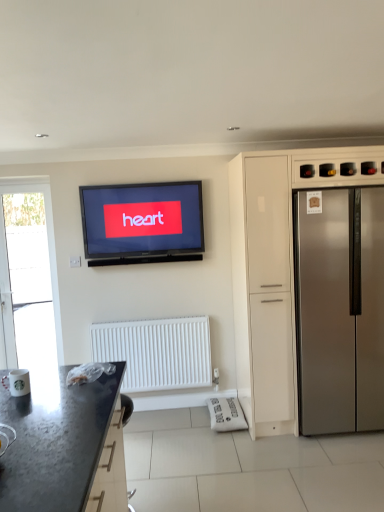
Find the location of a particular element. Image resolution: width=384 pixels, height=512 pixels. black granite countertop at lower left is located at coordinates (64, 446).

This screenshot has width=384, height=512. Describe the element at coordinates (157, 352) in the screenshot. I see `white matte radiator at lower center` at that location.

Measure the distance between point (173, 368) and camera.

The distance of point (173, 368) from camera is 3.60 meters.

Identify the location of stainless steel refrigerator at right. The height and width of the screenshot is (512, 384). (340, 310).

The image size is (384, 512). What are the coordinates of `black granite countertop at lower left` in the screenshot? It's located at (64, 446).

You are a GUI agent. You are given a task and a screenshot of the screen. Output one action in this format:
    pyautogui.click(x=<x>, y=<y>)
    Task: Click on the cabinetry on the right of white matte radiator at lower center
    
    Given the screenshot: What is the action you would take?
    pyautogui.click(x=276, y=245)

Is white matte radiator at lower center positioned far away from satin silver refrigerator at right?

Actually, white matte radiator at lower center and satin silver refrigerator at right are a little close together.

Consider the image. How different are the orientations of white matte radiator at lower center and satin silver refrigerator at right in degrees?

0.27 degrees separate the facing orientations of white matte radiator at lower center and satin silver refrigerator at right.

Is white matte radiator at lower center behind satin silver refrigerator at right?

Yes, white matte radiator at lower center is further from the camera.

Looking at this image, considering the relative sizes of stainless steel refrigerator at right and satin silver refrigerator at right in the image provided, is stainless steel refrigerator at right bigger than satin silver refrigerator at right?

Incorrect, stainless steel refrigerator at right is not larger than satin silver refrigerator at right.

This screenshot has height=512, width=384. Find the location of `cabinetry positioned vertically above the stainless steel refrigerator at right (from a real-world perspective)`. cabinetry positioned vertically above the stainless steel refrigerator at right (from a real-world perspective) is located at coordinates (276, 245).

From the image's perspective, would you say stainless steel refrigerator at right is positioned over satin silver refrigerator at right?

No, from the image's perspective, stainless steel refrigerator at right is not on top of satin silver refrigerator at right.

Considering the sizes of stainless steel refrigerator at right and satin silver refrigerator at right in the image, is stainless steel refrigerator at right taller or shorter than satin silver refrigerator at right?

Clearly, stainless steel refrigerator at right is shorter compared to satin silver refrigerator at right.

Considering the sizes of objects satin silver refrigerator at right and matte black television at upper center in the image provided, who is bigger, satin silver refrigerator at right or matte black television at upper center?

With larger size is satin silver refrigerator at right.

Considering the positions of objects satin silver refrigerator at right and matte black television at upper center in the image provided, who is more to the left, satin silver refrigerator at right or matte black television at upper center?

Positioned to the left is matte black television at upper center.

Is satin silver refrigerator at right in contact with matte black television at upper center?

No, satin silver refrigerator at right is not next to matte black television at upper center.

Considering the relative sizes of satin silver refrigerator at right and matte black television at upper center in the image provided, is satin silver refrigerator at right wider than matte black television at upper center?

Yes.

From the picture: Between black granite countertop at lower left and matte black television at upper center, which one has smaller width?

With smaller width is matte black television at upper center.

In terms of height, does black granite countertop at lower left look taller or shorter compared to matte black television at upper center?

black granite countertop at lower left is taller than matte black television at upper center.

Is black granite countertop at lower left far from matte black television at upper center?

Indeed, black granite countertop at lower left is not near matte black television at upper center.

How distant is black granite countertop at lower left from matte black television at upper center?

The distance of black granite countertop at lower left from matte black television at upper center is 1.77 meters.

From a real-world perspective, is satin silver refrigerator at right positioned over white matte radiator at lower center based on gravity?

Yes, from a real-world perspective, satin silver refrigerator at right is over white matte radiator at lower center

Consider the image. Would you say satin silver refrigerator at right is to the left or to the right of white matte radiator at lower center in the picture?

In the image, satin silver refrigerator at right appears on the right side of white matte radiator at lower center.

Is satin silver refrigerator at right aimed at white matte radiator at lower center?

No, satin silver refrigerator at right is not oriented towards white matte radiator at lower center.

Considering the positions of objects white matte radiator at lower center and transparent glass door at left in the image provided, who is in front, white matte radiator at lower center or transparent glass door at left?

white matte radiator at lower center.

Would you say white matte radiator at lower center is inside or outside transparent glass door at left?

white matte radiator at lower center is not inside transparent glass door at left, it's outside.

How much distance is there between black granite countertop at lower left and transparent glass door at left?

black granite countertop at lower left is 6.62 feet from transparent glass door at left.

Identify the location of countertop that is under the transparent glass door at left (from a real-world perspective). (64, 446).

Which is less distant, (x=44, y=387) or (x=35, y=191)?

Clearly, point (x=44, y=387) is closer to the camera than point (x=35, y=191).

Between black granite countertop at lower left and transparent glass door at left, which one has more height?

Standing taller between the two is transparent glass door at left.

In order to click on cabinetry in front of the white matte radiator at lower center in this screenshot , I will do (276, 245).

Where is `cabinetry above the stainless steel refrigerator at right (from a real-world perspective)`? Image resolution: width=384 pixels, height=512 pixels. cabinetry above the stainless steel refrigerator at right (from a real-world perspective) is located at coordinates (276, 245).

Based on their spatial positions, is white matte radiator at lower center or matte black television at upper center further from satin silver refrigerator at right?

The object further to satin silver refrigerator at right is white matte radiator at lower center.

From the image, which object appears to be nearer to transparent glass door at left, white matte radiator at lower center or satin silver refrigerator at right?

white matte radiator at lower center is positioned closer to the anchor transparent glass door at left.

When comparing their distances from white matte radiator at lower center, does matte black television at upper center or stainless steel refrigerator at right seem closer?

The object closer to white matte radiator at lower center is matte black television at upper center.

Which object lies nearer to the anchor point matte black television at upper center, white matte radiator at lower center or satin silver refrigerator at right?

The object closer to matte black television at upper center is white matte radiator at lower center.

From the image, which object appears to be farther from matte black television at upper center, stainless steel refrigerator at right or transparent glass door at left?

Among the two, stainless steel refrigerator at right is located further to matte black television at upper center.

Considering their positions, is satin silver refrigerator at right positioned closer to white matte radiator at lower center than transparent glass door at left?

The object closer to white matte radiator at lower center is transparent glass door at left.

Estimate the real-world distances between objects in this image. Which object is closer to transparent glass door at left, black granite countertop at lower left or white matte radiator at lower center?

white matte radiator at lower center lies closer to transparent glass door at left than the other object.

Based on their spatial positions, is matte black television at upper center or black granite countertop at lower left further from satin silver refrigerator at right?

The object further to satin silver refrigerator at right is black granite countertop at lower left.

Where is `television between black granite countertop at lower left and white matte radiator at lower center in the front-back direction`? The width and height of the screenshot is (384, 512). television between black granite countertop at lower left and white matte radiator at lower center in the front-back direction is located at coordinates (142, 223).

The width and height of the screenshot is (384, 512). Find the location of `radiator between transparent glass door at left and stainless steel refrigerator at right from left to right`. radiator between transparent glass door at left and stainless steel refrigerator at right from left to right is located at coordinates (157, 352).

The image size is (384, 512). What are the coordinates of `refrigerator between black granite countertop at lower left and matte black television at upper center from front to back` in the screenshot? It's located at (340, 310).

Find the location of a particular element. The image size is (384, 512). cabinetry located between black granite countertop at lower left and matte black television at upper center in the depth direction is located at coordinates (276, 245).